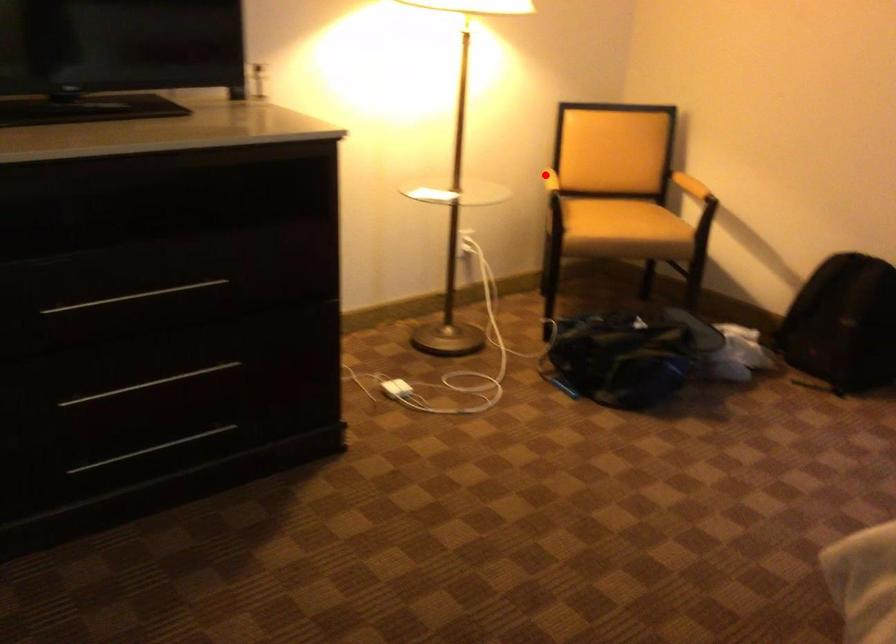
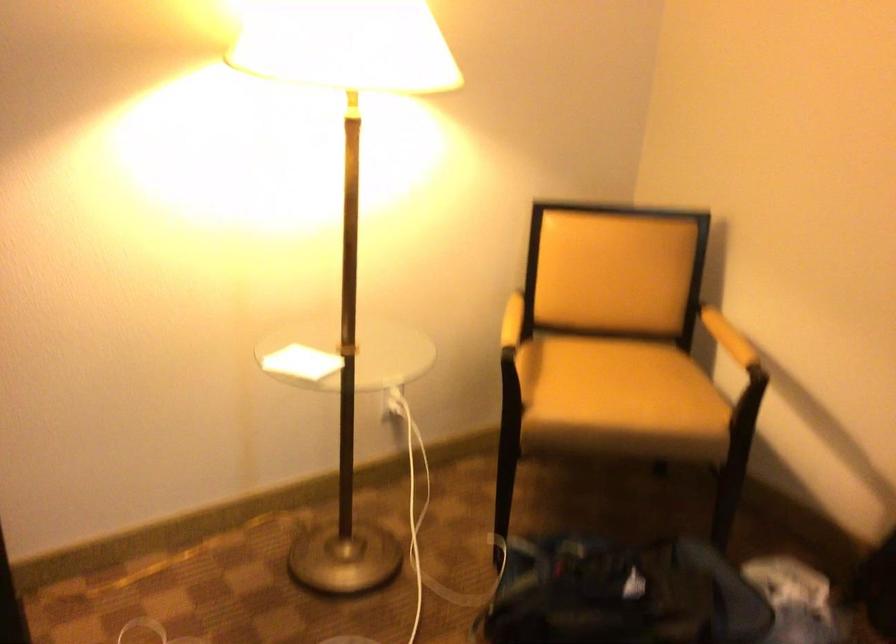
Question: I am providing you with two images of the same scene from different viewpoints. A red point is shown in image1. For the corresponding object point in image2, is it positioned nearer or farther from the camera?

Choices:
 (A) Nearer
 (B) Farther

Answer: (A)